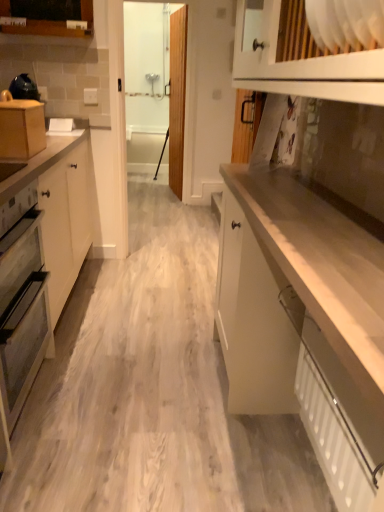
Question: Is transparent glass door at upper center positioned beyond the bounds of wooden cabinet at upper left, which is counted as the 3th cabinetry, starting from the bottom?

Choices:
 (A) no
 (B) yes

Answer: (B)

Question: Considering the relative sizes of transparent glass door at upper center and wooden cabinet at upper left, which is the 1th cabinetry from top to bottom, in the image provided, is transparent glass door at upper center wider than wooden cabinet at upper left, which is the 1th cabinetry from top to bottom,?

Choices:
 (A) yes
 (B) no

Answer: (B)

Question: Is transparent glass door at upper center positioned far away from wooden cabinet at upper left, which is the 1th cabinetry from top to bottom?

Choices:
 (A) no
 (B) yes

Answer: (B)

Question: Is transparent glass door at upper center oriented towards wooden cabinet at upper left, the first cabinetry from the left?

Choices:
 (A) no
 (B) yes

Answer: (B)

Question: Is transparent glass door at upper center behind wooden cabinet at upper left, the 1th cabinetry viewed from the back?

Choices:
 (A) yes
 (B) no

Answer: (A)

Question: Is transparent glass door at upper center at the left side of wooden cabinet at upper left, the first cabinetry from the left?

Choices:
 (A) no
 (B) yes

Answer: (A)

Question: Would you say white textured radiator at lower right is part of matte gray oven at left's contents?

Choices:
 (A) no
 (B) yes

Answer: (A)

Question: Is matte gray oven at left completely or partially outside of white textured radiator at lower right?

Choices:
 (A) yes
 (B) no

Answer: (A)

Question: From the image's perspective, does matte gray oven at left appear lower than white textured radiator at lower right?

Choices:
 (A) no
 (B) yes

Answer: (A)

Question: From the image's perspective, is matte gray oven at left on white textured radiator at lower right?

Choices:
 (A) yes
 (B) no

Answer: (A)

Question: Considering the relative sizes of matte gray oven at left and white textured radiator at lower right in the image provided, is matte gray oven at left taller than white textured radiator at lower right?

Choices:
 (A) yes
 (B) no

Answer: (A)

Question: Is matte gray oven at left positioned in front of white textured radiator at lower right?

Choices:
 (A) yes
 (B) no

Answer: (B)

Question: Is white matte cabinet at center, positioned as the first cabinetry in front-to-back order, shorter than matte gray oven at left?

Choices:
 (A) no
 (B) yes

Answer: (B)